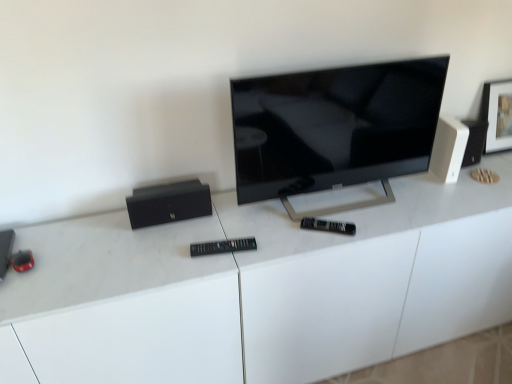
The height and width of the screenshot is (384, 512). In order to click on vacant space behind black plastic remote at center in this screenshot , I will do point(229,226).